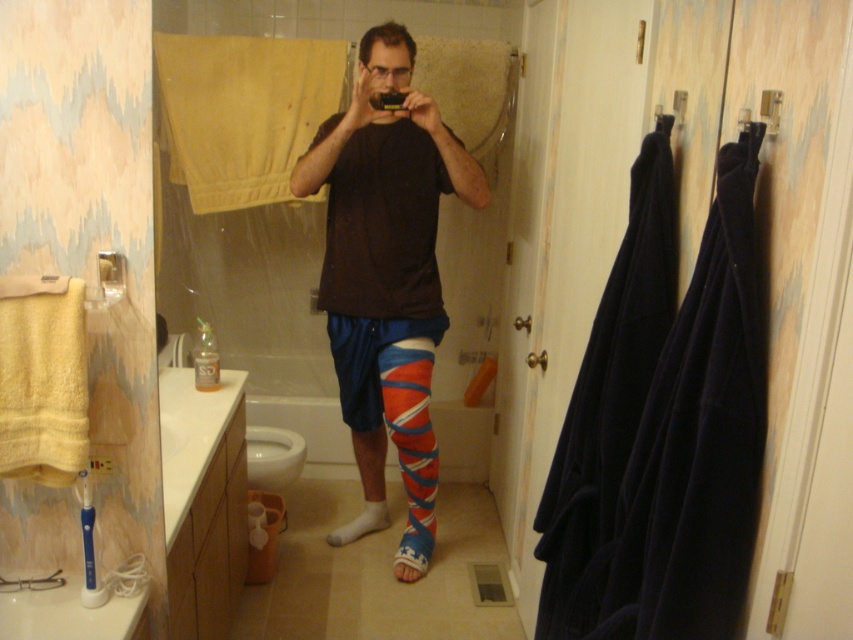
Can you confirm if matte blue shorts at center is positioned to the right of white cotton sock at lower center?

Yes, matte blue shorts at center is to the right of white cotton sock at lower center.

Which is behind, point (416, 352) or point (386, 525)?

Point (386, 525)

Identify the location of matte blue shorts at center. (387, 269).